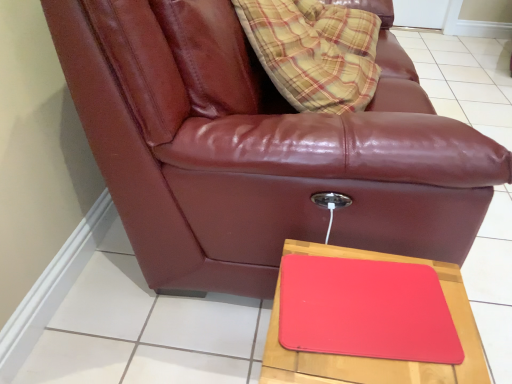
The height and width of the screenshot is (384, 512). What do you see at coordinates (376, 359) in the screenshot? I see `rubberized red tray at lower right` at bounding box center [376, 359].

The width and height of the screenshot is (512, 384). What are the coordinates of `rubberized red tray at lower right` in the screenshot? It's located at [x=376, y=359].

At what (x,y) coordinates should I click in order to perform the action: click on matte leather couch at center. Please return your answer as a coordinate pair (x, y). Looking at the image, I should click on (259, 148).

What do you see at coordinates (259, 148) in the screenshot? I see `matte leather couch at center` at bounding box center [259, 148].

Where is `rubberized red tray at lower right`? The width and height of the screenshot is (512, 384). rubberized red tray at lower right is located at coordinates click(376, 359).

Considering the relative positions of rubberized red tray at lower right and matte leather couch at center in the image provided, is rubberized red tray at lower right to the left or to the right of matte leather couch at center?

rubberized red tray at lower right is to the right of matte leather couch at center.

Considering their positions, is rubberized red tray at lower right located in front of or behind matte leather couch at center?

rubberized red tray at lower right is in front of matte leather couch at center.

Does point (341, 359) appear closer or farther from the camera than point (102, 34)?

Point (341, 359) appears to be closer to the viewer than point (102, 34).

From the image's perspective, which object appears higher, rubberized red tray at lower right or matte leather couch at center?

From the image's view, matte leather couch at center is above.

From a real-world perspective, is rubberized red tray at lower right over matte leather couch at center?

Incorrect, from a real-world perspective, rubberized red tray at lower right is lower than matte leather couch at center.

Between rubberized red tray at lower right and matte leather couch at center, which one has smaller width?

rubberized red tray at lower right.

Between rubberized red tray at lower right and matte leather couch at center, which one has less height?

With less height is rubberized red tray at lower right.

Between rubberized red tray at lower right and matte leather couch at center, which one has smaller size?

rubberized red tray at lower right is smaller.

Is rubberized red tray at lower right outside of matte leather couch at center?

Yes, rubberized red tray at lower right is outside of matte leather couch at center.

Is rubberized red tray at lower right not near matte leather couch at center?

No, there isn't a large distance between rubberized red tray at lower right and matte leather couch at center.

Is rubberized red tray at lower right oriented towards matte leather couch at center?

No, rubberized red tray at lower right is not turned towards matte leather couch at center.

How many degrees apart are the facing directions of rubberized red tray at lower right and matte leather couch at center?

3.87 degrees separate the facing orientations of rubberized red tray at lower right and matte leather couch at center.

Identify the location of chair that is on the left side of rubberized red tray at lower right. The width and height of the screenshot is (512, 384). click(259, 148).

Which is more to the left, matte leather couch at center or rubberized red tray at lower right?

matte leather couch at center.

Which object is closer to the camera, matte leather couch at center or rubberized red tray at lower right?

rubberized red tray at lower right is more forward.

Does point (128, 176) come farther from viewer compared to point (271, 318)?

Yes, point (128, 176) is behind point (271, 318).

From the image's perspective, which one is positioned higher, matte leather couch at center or rubberized red tray at lower right?

matte leather couch at center is shown above in the image.

From a real-world perspective, relative to rubberized red tray at lower right, is matte leather couch at center vertically above or below?

In terms of real-world spatial position, matte leather couch at center is above rubberized red tray at lower right.

In terms of width, does matte leather couch at center look wider or thinner when compared to rubberized red tray at lower right?

In the image, matte leather couch at center appears to be wider than rubberized red tray at lower right.

Considering the sizes of objects matte leather couch at center and rubberized red tray at lower right in the image provided, who is shorter, matte leather couch at center or rubberized red tray at lower right?

With less height is rubberized red tray at lower right.

Is matte leather couch at center bigger or smaller than rubberized red tray at lower right?

matte leather couch at center is bigger than rubberized red tray at lower right.

Do you think matte leather couch at center is within rubberized red tray at lower right, or outside of it?

matte leather couch at center is outside rubberized red tray at lower right.

Is matte leather couch at center far away from rubberized red tray at lower right?

matte leather couch at center is near rubberized red tray at lower right, not far away.

Is matte leather couch at center facing away from rubberized red tray at lower right?

That's not correct — matte leather couch at center is not looking away from rubberized red tray at lower right.

How many degrees apart are the facing directions of matte leather couch at center and rubberized red tray at lower right?

The angle between the facing direction of matte leather couch at center and the facing direction of rubberized red tray at lower right is 3.87 degrees.

Measure the distance from matte leather couch at center to rubberized red tray at lower right.

matte leather couch at center and rubberized red tray at lower right are 11.64 inches apart.

Locate an element on the screen. This screenshot has height=384, width=512. chair above the rubberized red tray at lower right (from a real-world perspective) is located at coordinates (259, 148).

This screenshot has height=384, width=512. In order to click on table below the matte leather couch at center (from a real-world perspective) in this screenshot , I will do `click(376, 359)`.

At what (x,y) coordinates should I click in order to perform the action: click on table in front of the matte leather couch at center. Please return your answer as a coordinate pair (x, y). The width and height of the screenshot is (512, 384). Looking at the image, I should click on (376, 359).